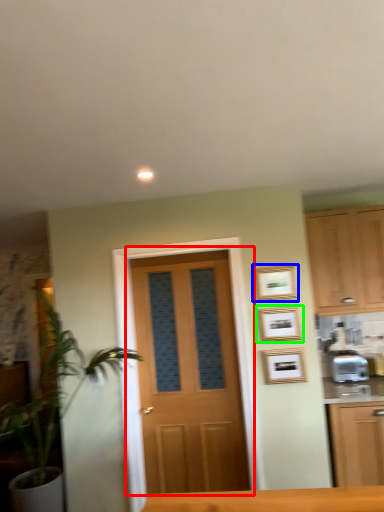
Question: Which object is positioned closest to door (highlighted by a red box)? Select from picture frame (highlighted by a blue box) and picture frame (highlighted by a green box).

Choices:
 (A) picture frame
 (B) picture frame

Answer: (B)